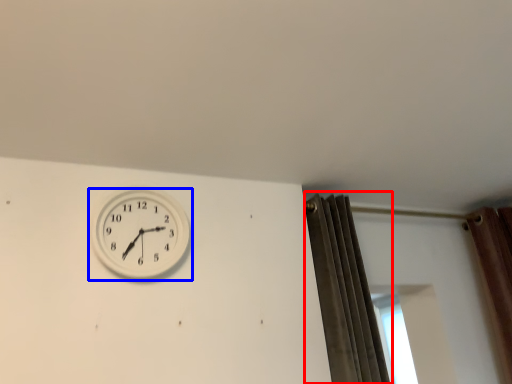
Question: Which object is further to the camera taking this photo, curtain (highlighted by a red box) or wall clock (highlighted by a blue box)?

Choices:
 (A) curtain
 (B) wall clock

Answer: (A)